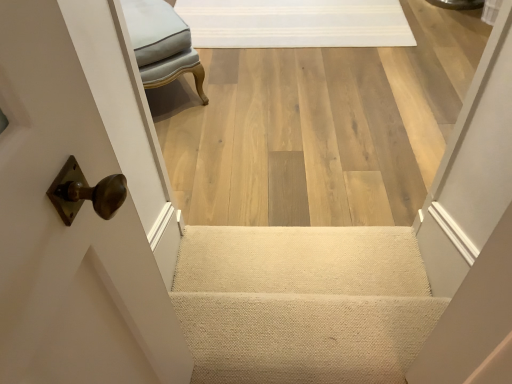
What are the coordinates of `white wood plank at upper center` in the screenshot? It's located at (295, 23).

Describe the element at coordinates (295, 23) in the screenshot. I see `white wood plank at upper center` at that location.

You are a GUI agent. You are given a task and a screenshot of the screen. Output one action in this format:
    pyautogui.click(x=<x>, y=<y>)
    Task: Click on the white wood plank at upper center
    
    Given the screenshot: What is the action you would take?
    pyautogui.click(x=295, y=23)